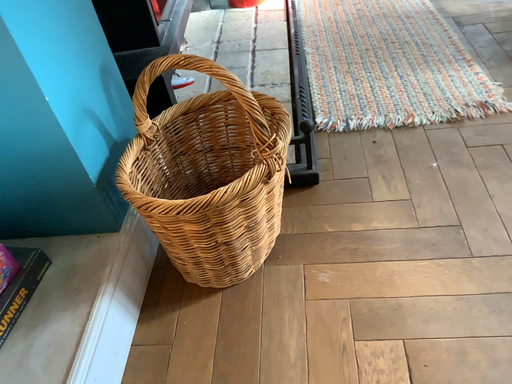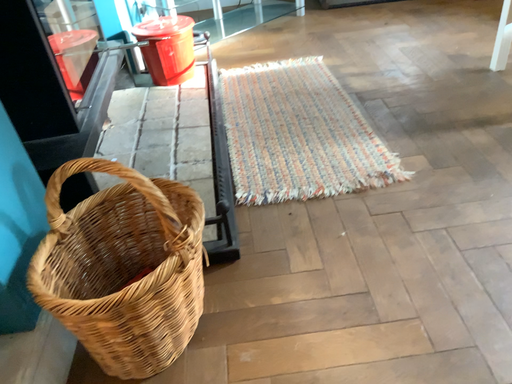
Question: How did the camera likely rotate when shooting the video?

Choices:
 (A) rotated upward
 (B) rotated downward

Answer: (A)